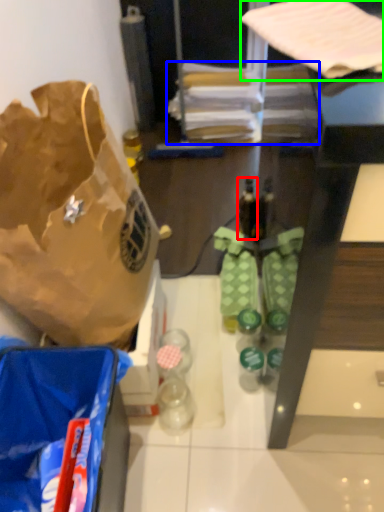
Question: Which is farther away from bottle (highlighted by a red box)? wrapping paper (highlighted by a blue box) or wrapping paper (highlighted by a green box)?

Choices:
 (A) wrapping paper
 (B) wrapping paper

Answer: (B)